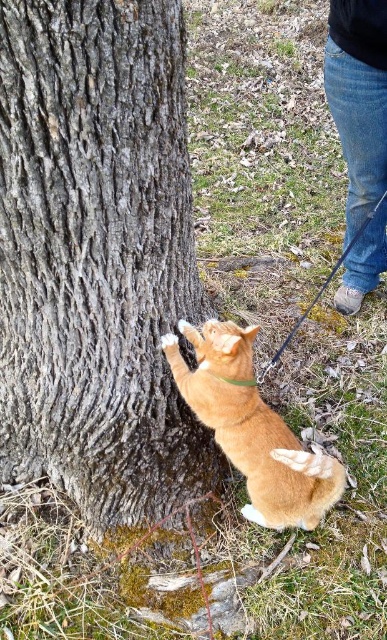
Question: Estimate the real-world distances between objects in this image. Which object is closer to the jeans at lower right?

Choices:
 (A) gray rough bark tree trunk at center
 (B) orange fur cat at center

Answer: (A)

Question: In this image, where is gray rough bark tree trunk at center located relative to orange fur cat at center?

Choices:
 (A) left
 (B) right

Answer: (A)

Question: Considering the real-world distances, which object is closest to the gray rough bark tree trunk at center?

Choices:
 (A) jeans at lower right
 (B) orange fur cat at center

Answer: (B)

Question: Can you confirm if gray rough bark tree trunk at center is wider than orange fur cat at center?

Choices:
 (A) no
 (B) yes

Answer: (B)

Question: Does gray rough bark tree trunk at center have a greater width compared to jeans at lower right?

Choices:
 (A) no
 (B) yes

Answer: (B)

Question: Which object appears farthest from the camera in this image?

Choices:
 (A) jeans at lower right
 (B) gray rough bark tree trunk at center
 (C) orange fur cat at center

Answer: (A)